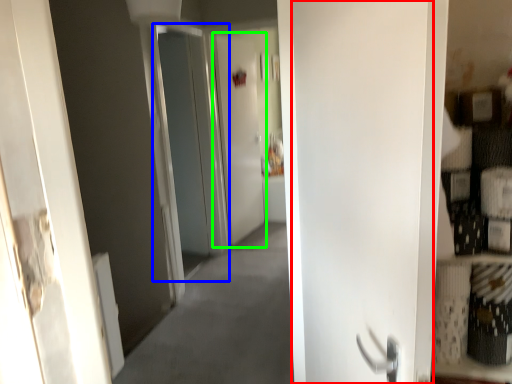
Question: Which is farther away from door (highlighted by a red box)? screen door (highlighted by a blue box) or screen door (highlighted by a green box)?

Choices:
 (A) screen door
 (B) screen door

Answer: (B)